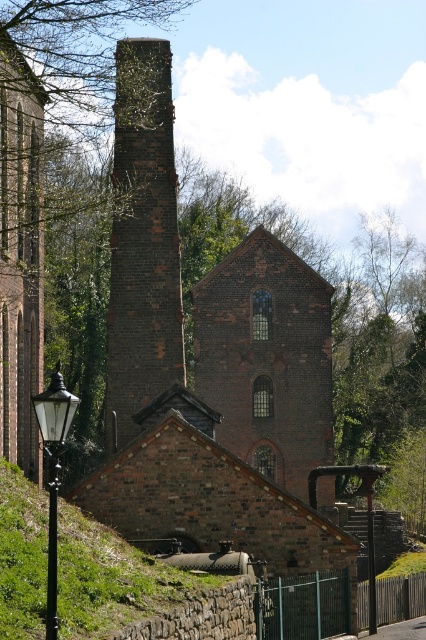
Question: Which point is closer to the camera?

Choices:
 (A) 37,337
 (B) 296,554
 (C) 58,374
 (D) 19,595

Answer: (C)

Question: Is brown brick church at center to the left of green grassy hillside at lower left from the viewer's perspective?

Choices:
 (A) no
 (B) yes

Answer: (A)

Question: Does dark brown brick chimney at center have a smaller size compared to brown brick tower at left?

Choices:
 (A) no
 (B) yes

Answer: (A)

Question: Which object is positioned closest to the dark brown brick chimney at center?

Choices:
 (A) brown brick tower at left
 (B) brown brick church at center
 (C) black glass lamp post at lower left
 (D) green grassy hillside at lower left

Answer: (B)

Question: In this image, where is dark brown brick chimney at center located relative to brown brick tower at left?

Choices:
 (A) right
 (B) left

Answer: (A)

Question: Which point is closer to the camera?

Choices:
 (A) brown brick tower at left
 (B) brown brick church at center

Answer: (B)